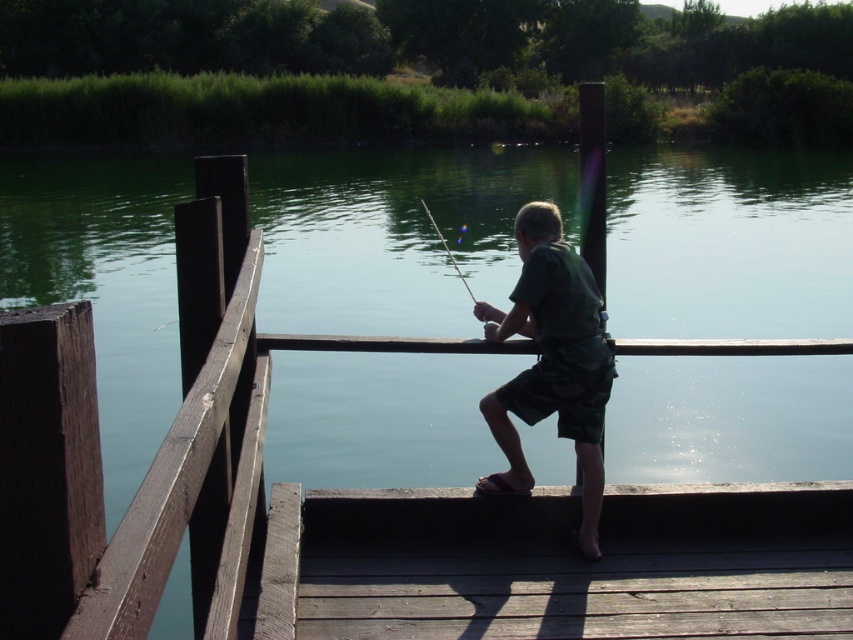
Question: Which point is closer to the camera?

Choices:
 (A) brown wooden dock at lower center
 (B) green matte shirt at center
 (C) smooth black rod at center

Answer: (A)

Question: Which point is closer to the camera?

Choices:
 (A) smooth black rod at center
 (B) brown wooden dock at lower center
 (C) green matte shirt at center

Answer: (B)

Question: Does metallic fishing rod at center have a lesser width compared to smooth black rod at center?

Choices:
 (A) no
 (B) yes

Answer: (A)

Question: Which point appears closest to the camera in this image?

Choices:
 (A) (312, 618)
 (B) (433, 225)
 (C) (575, 472)

Answer: (A)

Question: Does brown wooden dock at lower center appear under smooth black rod at center?

Choices:
 (A) yes
 (B) no

Answer: (A)

Question: Is brown wooden dock at lower center to the left of metallic fishing rod at center from the viewer's perspective?

Choices:
 (A) yes
 (B) no

Answer: (A)